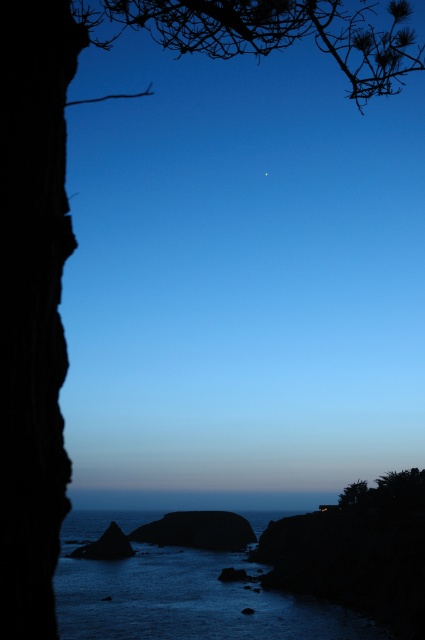
Is dark blue water at center further to camera compared to smooth gray rock at center?

No, it is not.

Is dark blue water at center in front of smooth gray rock at center?

Yes, it is in front of smooth gray rock at center.

Locate an element on the screen. dark blue water at center is located at coordinates click(181, 593).

Is dark rock cliff at left to the right of smooth dark rock at lower left from the viewer's perspective?

Indeed, dark rock cliff at left is positioned on the right side of smooth dark rock at lower left.

Can you confirm if dark rock cliff at left is positioned to the left of smooth dark rock at lower left?

In fact, dark rock cliff at left is to the right of smooth dark rock at lower left.

Which is in front, point (23, 108) or point (122, 536)?

Point (23, 108)

You are a GUI agent. You are given a task and a screenshot of the screen. Output one action in this format:
    pyautogui.click(x=<x>, y=<y>)
    Task: Click on the dark rock cliff at left
    This screenshot has height=640, width=425.
    Given the screenshot: What is the action you would take?
    pyautogui.click(x=33, y=305)

From the picture: Does dark rock cliff at left lie in front of dark blue water at center?

Yes, dark rock cliff at left is closer to the viewer.

Does point (33, 140) come farther from viewer compared to point (144, 518)?

No, it is not.

Locate an element on the screen. dark rock cliff at left is located at coordinates [33, 305].